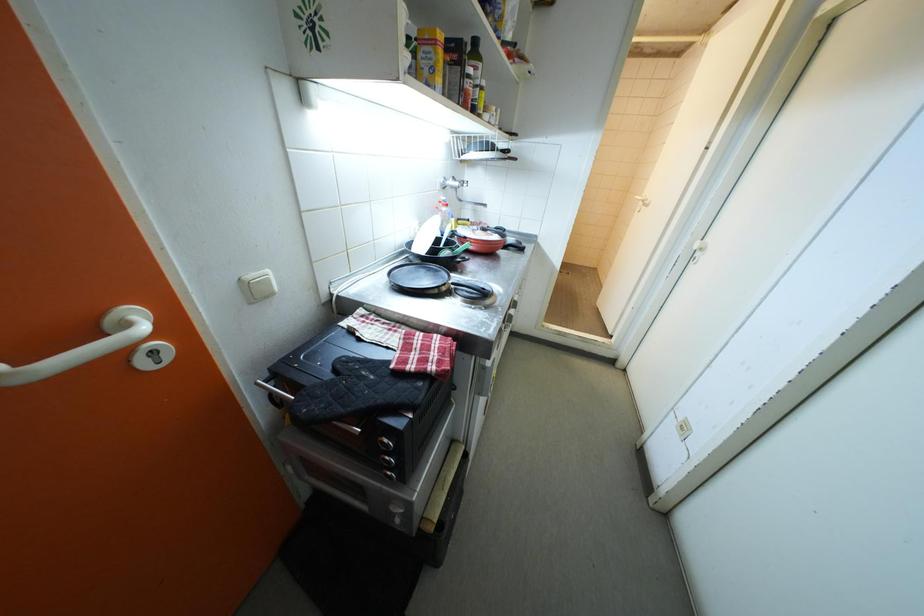
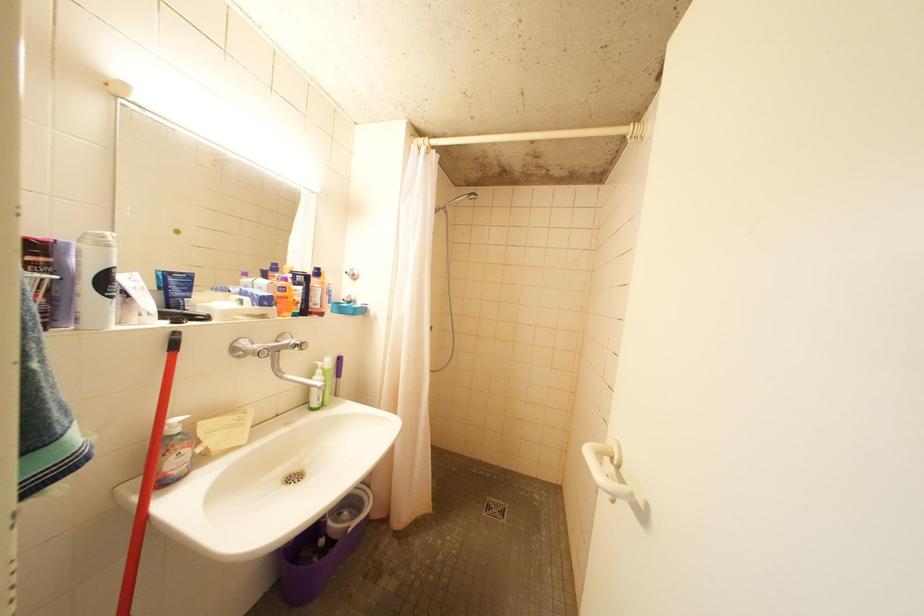
In a continuous first-person perspective shot, in which direction is the camera moving?

The movement direction of the cameraman is right, forward.